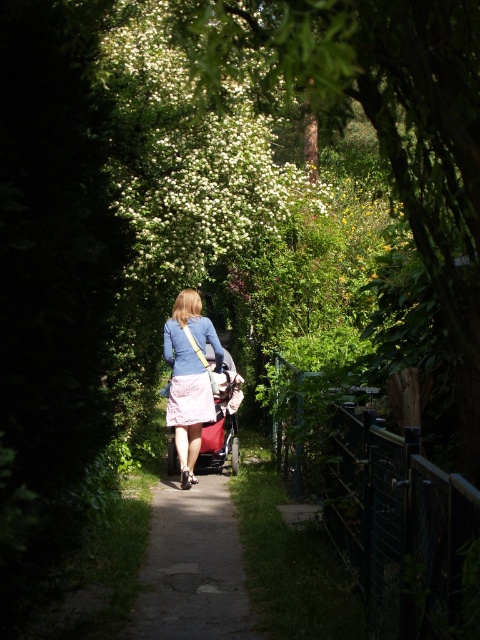
Question: In this image, where is paved asphalt path at center located relative to pink fabric skirt at center?

Choices:
 (A) above
 (B) below

Answer: (B)

Question: Is paved asphalt path at center positioned at the back of pink fabric skirt at center?

Choices:
 (A) no
 (B) yes

Answer: (A)

Question: Is paved asphalt path at center smaller than pink fabric skirt at center?

Choices:
 (A) no
 (B) yes

Answer: (B)

Question: Which is farther from the red fabric stroller at center?

Choices:
 (A) pink satin dress at center
 (B) pink fabric skirt at center
 (C) paved asphalt path at center

Answer: (C)

Question: Which object is the closest to the paved asphalt path at center?

Choices:
 (A) red fabric stroller at center
 (B) pink fabric skirt at center

Answer: (B)

Question: Which object appears farthest from the camera in this image?

Choices:
 (A) pink fabric skirt at center
 (B) paved asphalt path at center
 (C) red fabric stroller at center

Answer: (C)